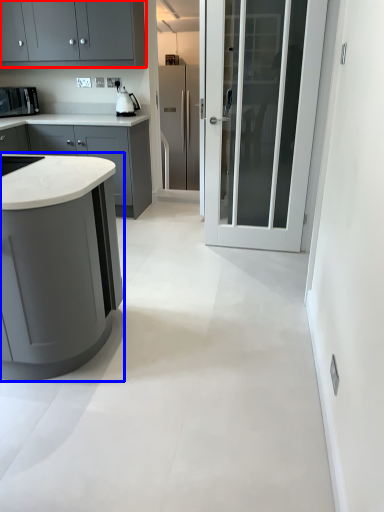
Question: Which of the following is the closest to the observer, cabinetry (highlighted by a red box) or cabinetry (highlighted by a blue box)?

Choices:
 (A) cabinetry
 (B) cabinetry

Answer: (B)